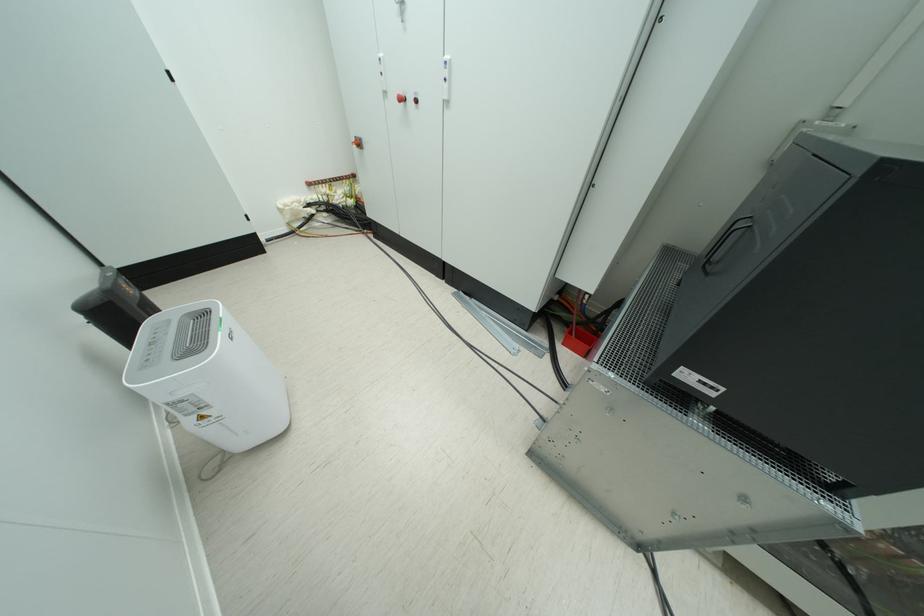
Identify the location of small red container. This screenshot has width=924, height=616. (578, 339).